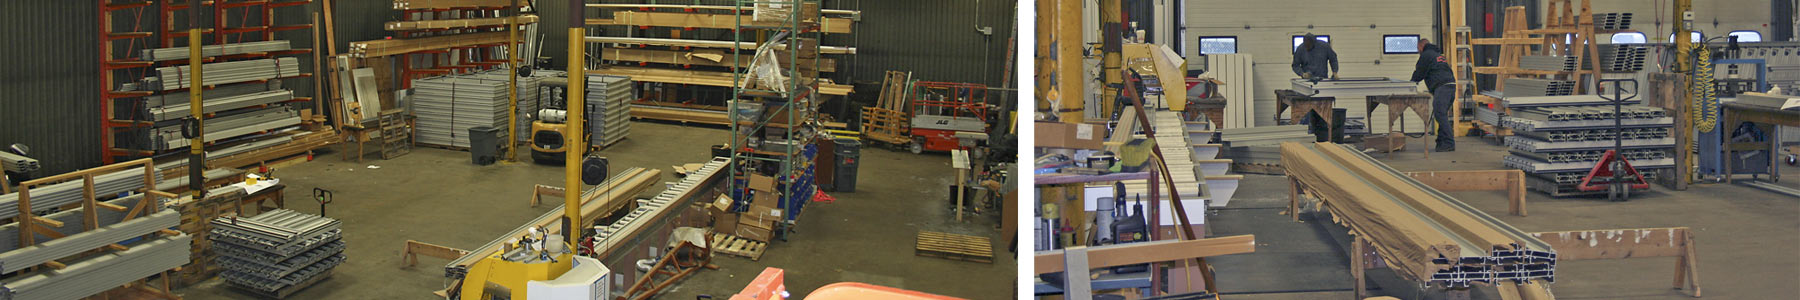
Identify the location of window. (1220, 40), (1292, 43), (1408, 46), (1634, 34), (1694, 38), (1748, 36).